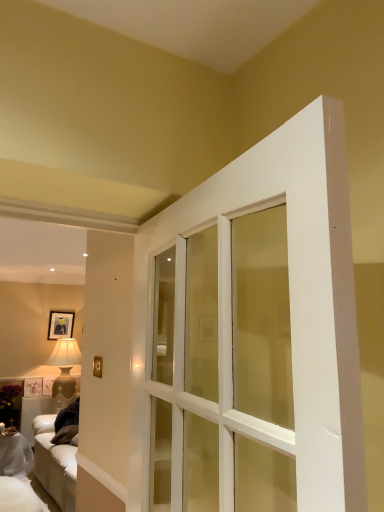
What do you see at coordinates (60, 324) in the screenshot?
I see `matte black picture frame at upper left` at bounding box center [60, 324].

Measure the distance between matte black picture frame at upper left and camera.

matte black picture frame at upper left and camera are 6.81 meters apart.

What are the coordinates of `white fabric couch at lower left` in the screenshot? It's located at (15, 456).

Is white fabric couch at lower left placed right next to matte beige lamp at left?

white fabric couch at lower left is not next to matte beige lamp at left, and they're not touching.

Could you tell me if white fabric couch at lower left is turned towards matte beige lamp at left?

No, white fabric couch at lower left is not facing towards matte beige lamp at left.

Considering the sizes of objects white fabric couch at lower left and matte beige lamp at left in the image provided, who is bigger, white fabric couch at lower left or matte beige lamp at left?

matte beige lamp at left.

Considering the positions of point (58, 405) and point (64, 313), is point (58, 405) closer or farther from the camera than point (64, 313)?

Point (58, 405).

Can you tell me how much matte beige lamp at left and matte black picture frame at upper left differ in facing direction?

They differ by 0.0101 degrees in their facing directions.

Does matte beige lamp at left have a lesser height compared to matte black picture frame at upper left?

In fact, matte beige lamp at left may be taller than matte black picture frame at upper left.

Is matte beige lamp at left in front of or behind matte black picture frame at upper left in the image?

matte beige lamp at left is in front of matte black picture frame at upper left.

Who is bigger, matte black picture frame at upper left or matte beige lamp at left?

Bigger between the two is matte beige lamp at left.

From the image's perspective, which is above, matte black picture frame at upper left or matte beige lamp at left?

matte black picture frame at upper left appears higher in the image.

How many degrees apart are the facing directions of matte black picture frame at upper left and matte beige lamp at left?

0.0101 degrees separate the facing orientations of matte black picture frame at upper left and matte beige lamp at left.

Image resolution: width=384 pixels, height=512 pixels. What are the coordinates of `picture frame that appears on the left of matte beige lamp at left` in the screenshot? It's located at (60, 324).

From the image's perspective, between white fabric couch at lower left and matte black picture frame at upper left, which one is located above?

matte black picture frame at upper left is shown above in the image.

Between white fabric couch at lower left and matte black picture frame at upper left, which one appears on the right side from the viewer's perspective?

matte black picture frame at upper left is more to the right.

Does point (18, 469) appear closer or farther from the camera than point (68, 324)?

Point (18, 469) is closer to the camera than point (68, 324).

Does white fabric couch at lower left have a greater height compared to matte black picture frame at upper left?

Indeed, white fabric couch at lower left has a greater height compared to matte black picture frame at upper left.

I want to click on furniture lying on the left of matte black picture frame at upper left, so click(x=15, y=456).

Which object is closer to the camera, matte black picture frame at upper left or white fabric couch at lower left?

white fabric couch at lower left is closer to the camera.

Is matte black picture frame at upper left turned away from white fabric couch at lower left?

No, matte black picture frame at upper left is not facing the opposite direction of white fabric couch at lower left.

Considering the relative sizes of matte black picture frame at upper left and white fabric couch at lower left in the image provided, is matte black picture frame at upper left taller than white fabric couch at lower left?

In fact, matte black picture frame at upper left may be shorter than white fabric couch at lower left.

From a real-world perspective, is matte beige lamp at left above or below white fabric couch at lower left?

From a real-world perspective, matte beige lamp at left is physically above white fabric couch at lower left.

How distant is matte beige lamp at left from white fabric couch at lower left?

matte beige lamp at left and white fabric couch at lower left are 33.52 inches apart from each other.

Which is correct: matte beige lamp at left is inside white fabric couch at lower left, or outside of it?

The correct answer is: outside.

Can you confirm if matte beige lamp at left is smaller than white fabric couch at lower left?

No.

Locate an element on the screen. furniture that is in front of the matte beige lamp at left is located at coordinates (15, 456).

Where is `picture frame above the matte beige lamp at left (from a real-world perspective)`? picture frame above the matte beige lamp at left (from a real-world perspective) is located at coordinates click(x=60, y=324).

Looking at the image, which one is located closer to white fabric couch at lower left, matte black picture frame at upper left or matte beige lamp at left?

matte beige lamp at left.

From the image, which object appears to be nearer to white fabric couch at lower left, matte beige lamp at left or matte black picture frame at upper left?

matte beige lamp at left is closer to white fabric couch at lower left.

Looking at the image, which one is located closer to matte beige lamp at left, white fabric couch at lower left or matte black picture frame at upper left?

matte black picture frame at upper left is closer to matte beige lamp at left.

Looking at the image, which one is located further to matte black picture frame at upper left, white fabric couch at lower left or matte beige lamp at left?

Among the two, white fabric couch at lower left is located further to matte black picture frame at upper left.

Estimate the real-world distances between objects in this image. Which object is closer to matte beige lamp at left, matte black picture frame at upper left or white fabric couch at lower left?

matte black picture frame at upper left is positioned closer to the anchor matte beige lamp at left.

From the image, which object appears to be nearer to matte black picture frame at upper left, matte beige lamp at left or white fabric couch at lower left?

matte beige lamp at left lies closer to matte black picture frame at upper left than the other object.

Image resolution: width=384 pixels, height=512 pixels. I want to click on lamp between matte black picture frame at upper left and white fabric couch at lower left in the up-down direction, so click(x=64, y=372).